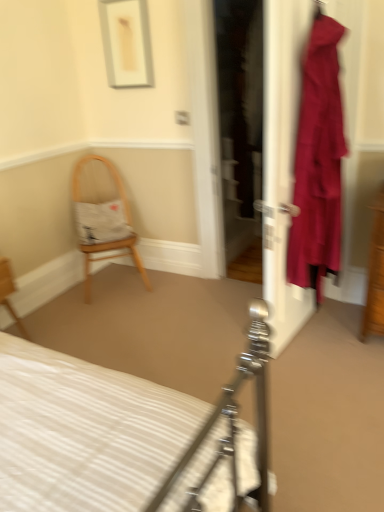
Question: Does wooden chair at lower left, which is the first chair in left-to-right order, touch velvet-like burgundy dress at right?

Choices:
 (A) yes
 (B) no

Answer: (B)

Question: Does wooden chair at lower left, which ranks as the first chair in front-to-back order, have a lesser height compared to velvet-like burgundy dress at right?

Choices:
 (A) no
 (B) yes

Answer: (B)

Question: Considering the relative sizes of wooden chair at lower left, which is the first chair in left-to-right order, and velvet-like burgundy dress at right in the image provided, is wooden chair at lower left, which is the first chair in left-to-right order, wider than velvet-like burgundy dress at right?

Choices:
 (A) yes
 (B) no

Answer: (B)

Question: Is wooden chair at lower left, which is the first chair in left-to-right order, positioned with its back to velvet-like burgundy dress at right?

Choices:
 (A) yes
 (B) no

Answer: (B)

Question: From a real-world perspective, is wooden chair at lower left, which ranks as the 2th chair in right-to-left order, below velvet-like burgundy dress at right?

Choices:
 (A) no
 (B) yes

Answer: (B)

Question: From the image's perspective, is wooden chair at lower left, placed as the 2th chair when sorted from back to front, under velvet-like burgundy dress at right?

Choices:
 (A) yes
 (B) no

Answer: (A)

Question: Is wooden chair with cushion at left, the 1th chair viewed from the back, smaller than velvet-like burgundy dress at right?

Choices:
 (A) yes
 (B) no

Answer: (B)

Question: Does wooden chair with cushion at left, the 1th chair viewed from the right, have a larger size compared to velvet-like burgundy dress at right?

Choices:
 (A) no
 (B) yes

Answer: (B)

Question: Is wooden chair with cushion at left, the second chair viewed from the left, located outside velvet-like burgundy dress at right?

Choices:
 (A) no
 (B) yes

Answer: (B)

Question: Is wooden chair with cushion at left, the 1th chair viewed from the right, at the left side of velvet-like burgundy dress at right?

Choices:
 (A) yes
 (B) no

Answer: (A)

Question: Can you see wooden chair with cushion at left, the second chair viewed from the left, touching velvet-like burgundy dress at right?

Choices:
 (A) no
 (B) yes

Answer: (A)

Question: Is white striped fabric bed at center completely or partially outside of wooden chair at lower left, placed as the 2th chair when sorted from back to front?

Choices:
 (A) yes
 (B) no

Answer: (A)